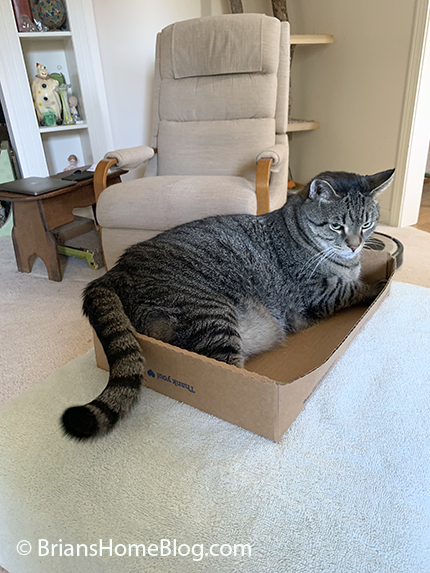
Locate an element on the screen. floor is located at coordinates (260, 485).